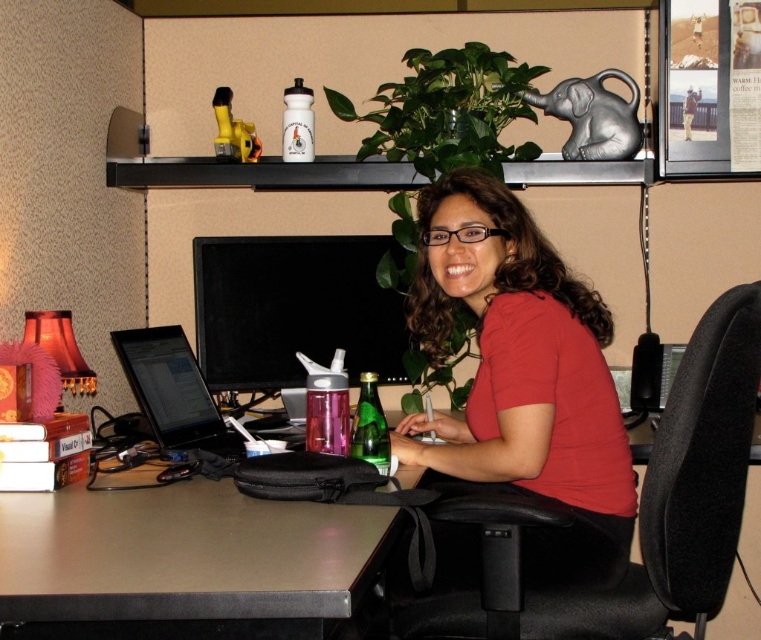
You are an office worker who wants to place a new name tag on your desk. The name tag is 10 cm wide. Can you fit it on the metallic gray computer desk at lower left without overlapping the red matte shirt at center?

The red matte shirt at center has a lesser width compared to metallic gray computer desk at lower left. Since the name tag is 10 cm wide and the desk is wider than the shirt, there should be enough space on the metallic gray computer desk at lower left to place the name tag without overlapping the red matte shirt at center.

You are an office worker who needs to reach the metallic gray computer desk at lower left. However, you are currently standing in front of the red matte shirt at center. Can you easily access the desk without moving the shirt?

The metallic gray computer desk at lower left is behind the red matte shirt at center, so you can easily access the desk by moving around the shirt or stepping behind it.